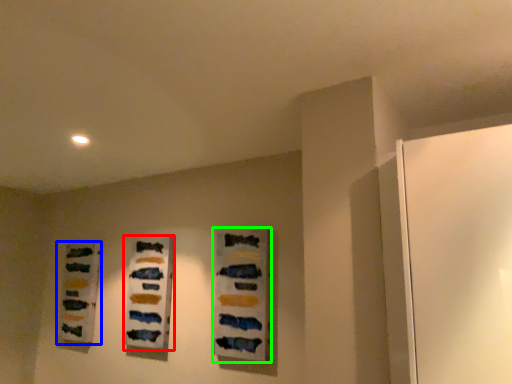
Question: Which object is the closest to the art (highlighted by a red box)? Choose among these: art (highlighted by a blue box) or art (highlighted by a green box).

Choices:
 (A) art
 (B) art

Answer: (B)